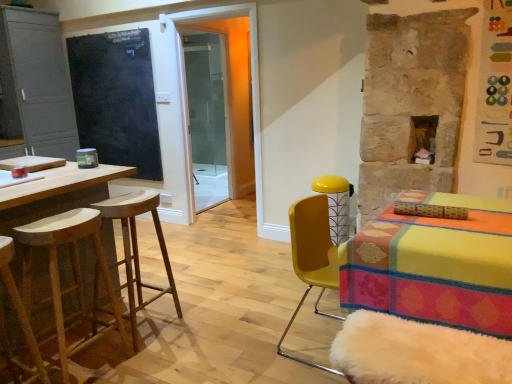
Question: Would you say natural wood stool at left, the second stool from the back, is inside or outside matte gray cabinet at left?

Choices:
 (A) outside
 (B) inside

Answer: (A)

Question: Considering the relative positions of natural wood stool at left, the second stool viewed from the front, and matte gray cabinet at left in the image provided, is natural wood stool at left, the second stool viewed from the front, to the left or to the right of matte gray cabinet at left?

Choices:
 (A) right
 (B) left

Answer: (A)

Question: Considering the real-world distances, which object is closest to the wooden stool at left, which is the first stool from front to back?

Choices:
 (A) transparent glass shower door at center
 (B) wooden bar stool at left, placed as the 3th stool when sorted from front to back
 (C) yellow matte chair at right
 (D) black chalkboard at left
 (E) natural wood stool at left, the second stool viewed from the front

Answer: (E)

Question: Estimate the real-world distances between objects in this image. Which object is farther from the matte gray cabinet at left?

Choices:
 (A) natural wood stool at left, the second stool from the back
 (B) yellow matte chair at right
 (C) transparent glass shower door at center
 (D) wooden bar stool at left, placed as the 3th stool when sorted from front to back
 (E) black chalkboard at left

Answer: (B)